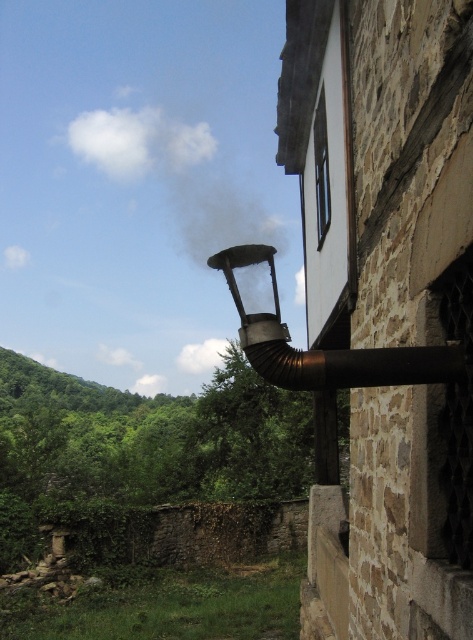
You are standing in front of the rustic stone building and want to take a photo. You notice two points marked on the building wall at coordinates point (146, 147) and point (250, 259). Which point is closer to your camera when taking the photo?

Point (146, 147) is further to the camera than point (250, 259), so the point closer to the camera is point (250, 259).

From the picture: You are a firefighter assessing the scene of a potential fire. You notice the white smoke at upper center and the bronze metallic chimney at upper right. Based on their positions, which object is higher in the image?

The white smoke at upper center is located above the bronze metallic chimney at upper right, so it is higher in the image.